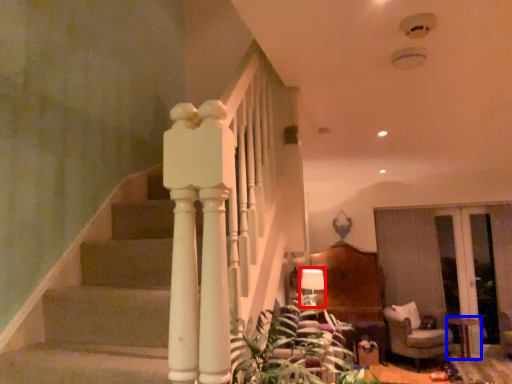
Question: Among these objects, which one is nearest to the camera, lamp (highlighted by a red box) or table (highlighted by a blue box)?

Choices:
 (A) lamp
 (B) table

Answer: (B)